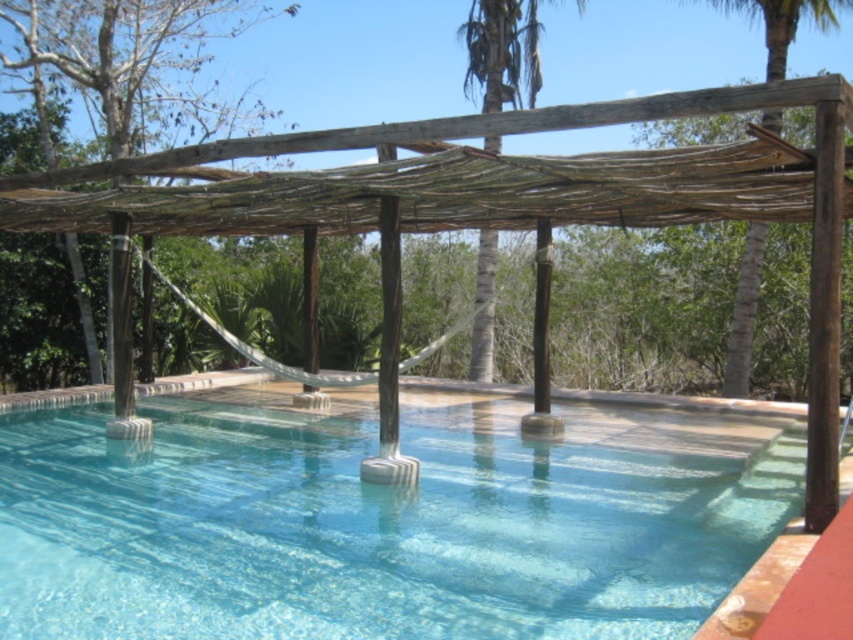
Question: Among these points, which one is nearest to the camera?

Choices:
 (A) (744, 378)
 (B) (462, 35)
 (C) (78, 10)
 (D) (144, 595)

Answer: (D)

Question: Which of these objects is positioned closest to the clear glass pool at center?

Choices:
 (A) green leafy tree at upper left
 (B) brown wood palm tree at upper right

Answer: (B)

Question: Is clear glass pool at center to the left of green leafy tree at upper left from the viewer's perspective?

Choices:
 (A) yes
 (B) no

Answer: (B)

Question: Estimate the real-world distances between objects in this image. Which object is closer to the clear glass pool at center?

Choices:
 (A) brown textured palm tree at center
 (B) brown wood palm tree at upper right
 (C) green leafy tree at upper left

Answer: (A)

Question: Can you confirm if green leafy tree at upper left is smaller than brown wood palm tree at upper right?

Choices:
 (A) no
 (B) yes

Answer: (B)

Question: Does clear glass pool at center appear on the left side of brown textured palm tree at center?

Choices:
 (A) yes
 (B) no

Answer: (A)